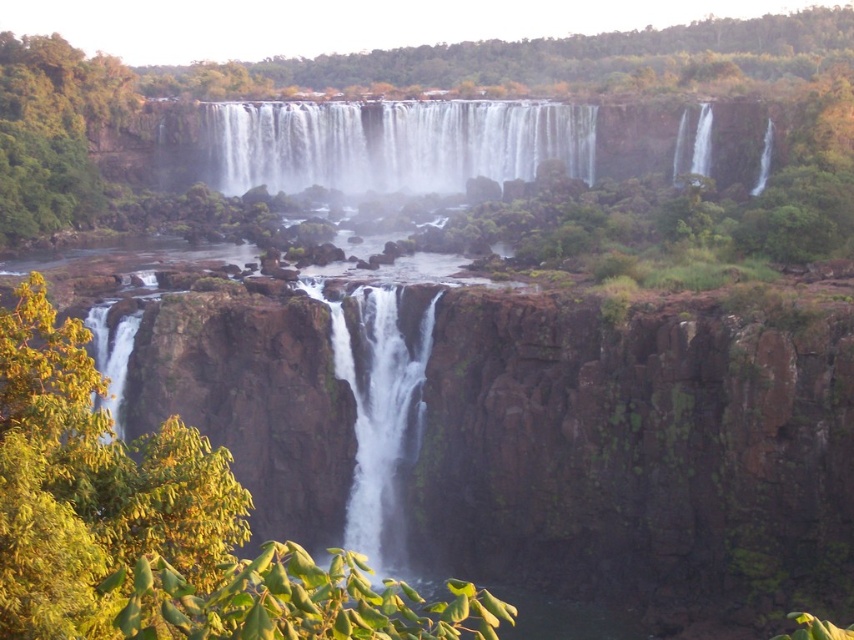
Can you confirm if white frothy water at center is taller than white smooth waterfall at center?

In fact, white frothy water at center may be shorter than white smooth waterfall at center.

This screenshot has width=854, height=640. Describe the element at coordinates (393, 145) in the screenshot. I see `white frothy water at center` at that location.

Which is behind, point (273, 161) or point (398, 470)?

Point (273, 161)

At what (x,y) coordinates should I click in order to perform the action: click on white frothy water at center. Please return your answer as a coordinate pair (x, y). The width and height of the screenshot is (854, 640). Looking at the image, I should click on (393, 145).